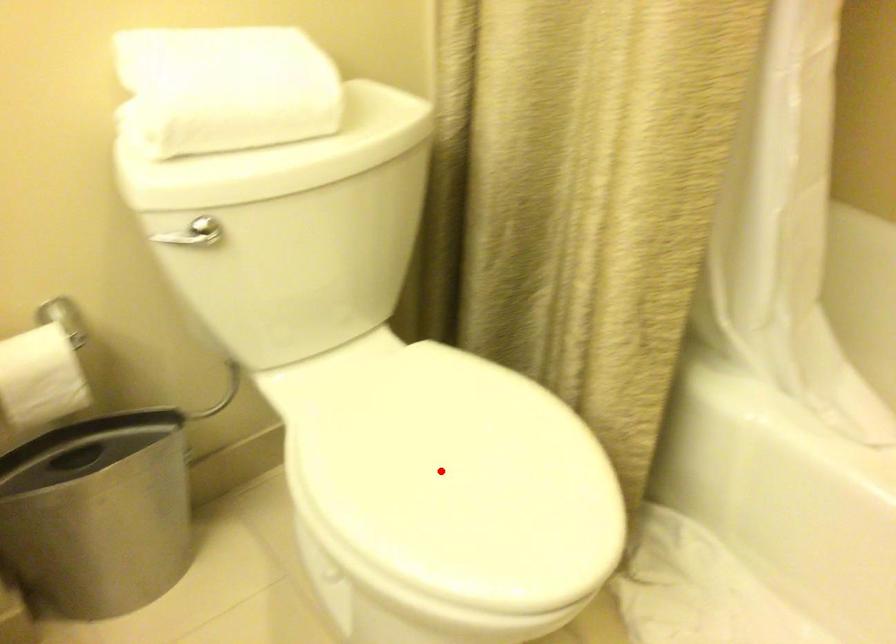
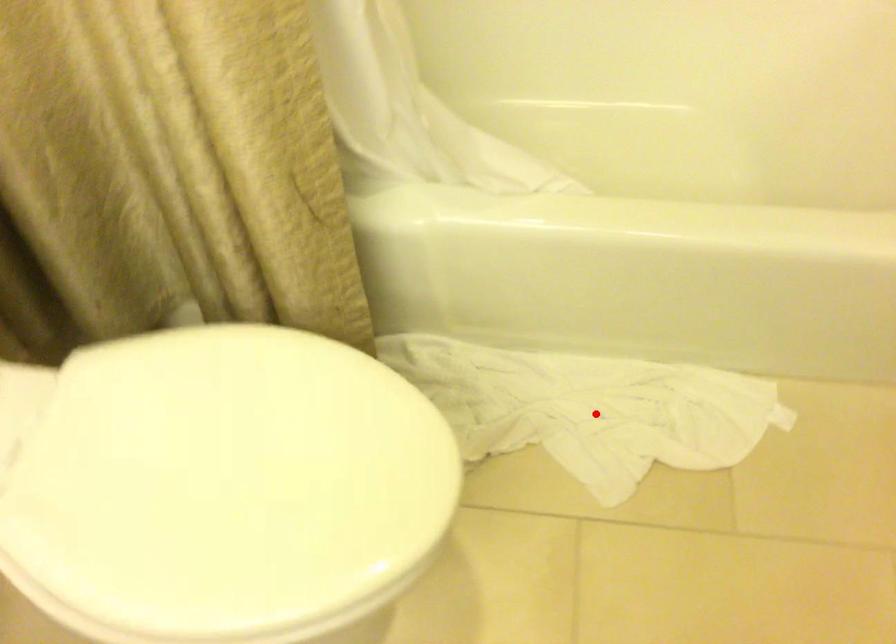
I am providing you with two images of the same scene from different viewpoints. A red point is marked on the first image and another point is marked on the second image. Does the point marked in image1 correspond to the same location as the one in image2?

No